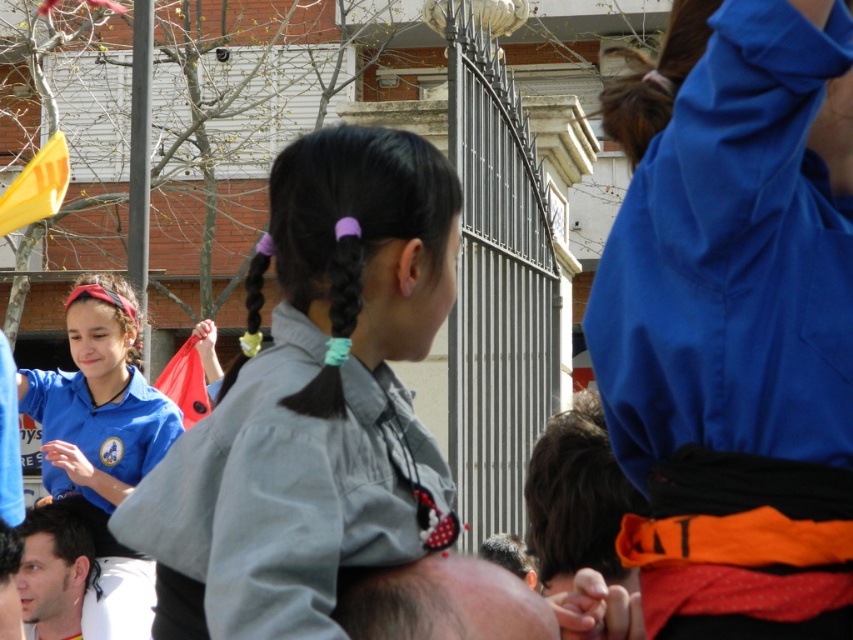
Consider the image. In the scene, there are two objects mentioned. The blue fabric shirt at left and the dark brown hair at lower left. Which one is positioned higher in the image?

The blue fabric shirt at left is located above dark brown hair at lower left, so the blue fabric shirt at left is positioned higher in the image.

You are a photographer taking a picture of the event. You notice the smooth gray shirt at center and the brown silky hair at upper center. Which one is closer to the camera?

The brown silky hair at upper center is closer to the camera because the smooth gray shirt at center is positioned under it.